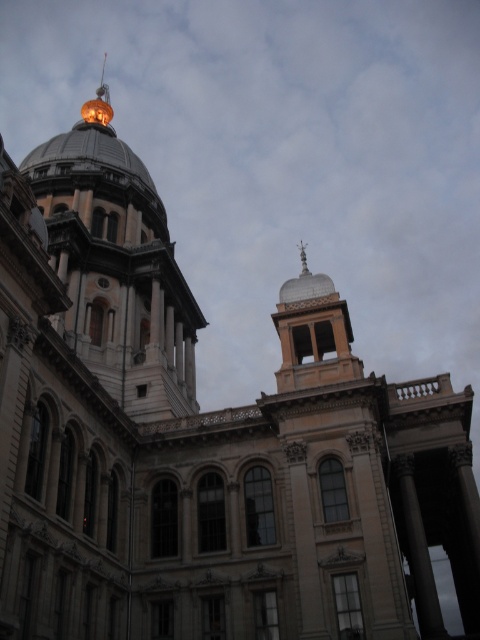
Question: Does shiny gold dome at upper left appear over silver metallic dome at upper center?

Choices:
 (A) yes
 (B) no

Answer: (A)

Question: Is shiny gold dome at upper left thinner than silver metallic dome at upper center?

Choices:
 (A) no
 (B) yes

Answer: (A)

Question: Can you confirm if shiny gold dome at upper left is positioned above silver metallic dome at upper center?

Choices:
 (A) no
 (B) yes

Answer: (B)

Question: Which point appears farthest from the camera in this image?

Choices:
 (A) (87, 340)
 (B) (304, 282)

Answer: (A)

Question: Which of the following is the closest to the observer?

Choices:
 (A) (294, 340)
 (B) (162, 296)

Answer: (A)

Question: Which point is farther from the camera taking this photo?

Choices:
 (A) (310, 340)
 (B) (104, 209)

Answer: (B)